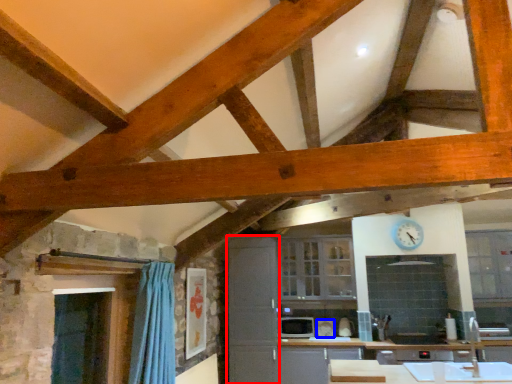
Question: Which object is closer to the camera taking this photo, cabinetry (highlighted by a red box) or appliance (highlighted by a blue box)?

Choices:
 (A) cabinetry
 (B) appliance

Answer: (A)